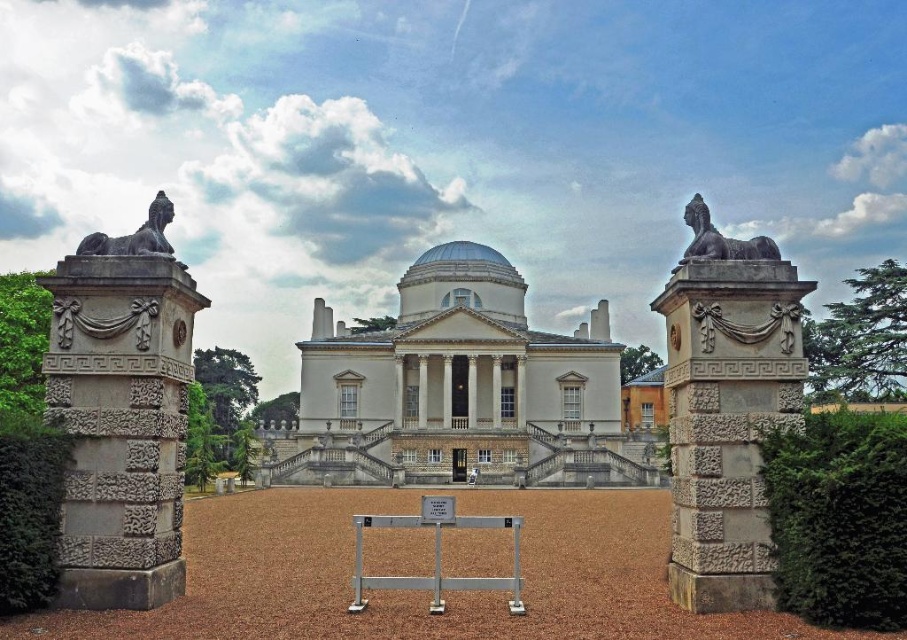
What is located at the coordinates point (457,388)?

The white stone mansion at center is located at point (457,388).

You are a landscape architect planning to install a new garden path between the two polished bronze sphinx statues. The path must be exactly 100 feet long. Based on the distance between the polished bronze sphinx at upper right and the polished bronze sphinx at left, will the path fit comfortably between them?

The distance between the polished bronze sphinx at upper right and the polished bronze sphinx at left is 103.21 feet. Since the required path length is 100 feet, the path will fit comfortably between them with 3.21 feet of extra space remaining.